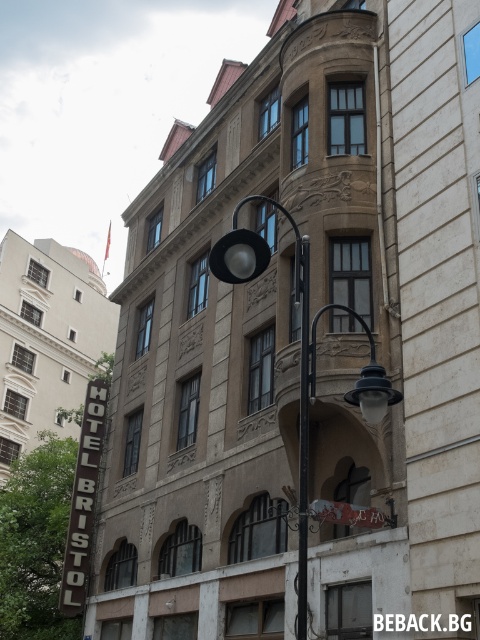
You are standing in front of the building and want to touch both the matte black lamp post at center and the metallic silver sign at center. Which object should you reach for first to touch the closer one?

The matte black lamp post at center is closer to the viewer than the metallic silver sign at center, so you should reach for the matte black lamp post at center first.

You are standing at the point marked as point (300, 348). What object is directly in front of you?

The matte black lamp post at center is located at point (300, 348), so the object directly in front of you is the matte black lamp post at center.